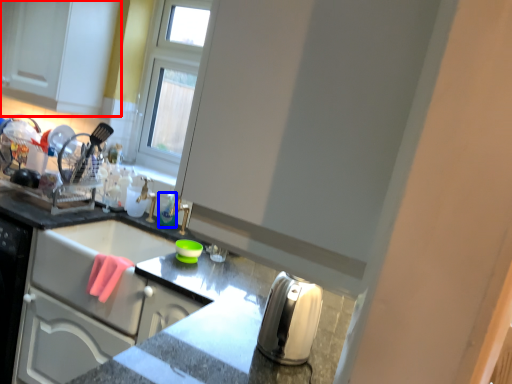
Question: Which point is further to the camera, cabinetry (highlighted by a red box) or bottle (highlighted by a blue box)?

Choices:
 (A) cabinetry
 (B) bottle

Answer: (B)